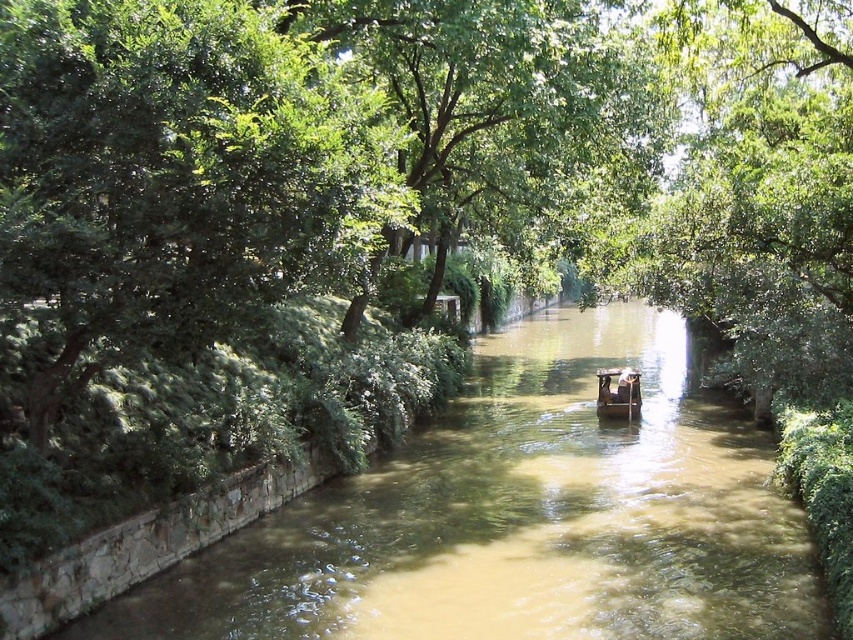
You are a kayaker planning to navigate through the canal shown in the scene. You have a kayak that is 1.2 meters wide. Can you safely pass through the area between the brown muddy water at center and the green leafy tree at center?

The brown muddy water at center might be wider than green leafy tree at center. Since the kayak is 1.2 meters wide, if the space between them is wider than 1.2 meters, it would be safe. However, the exact width isn